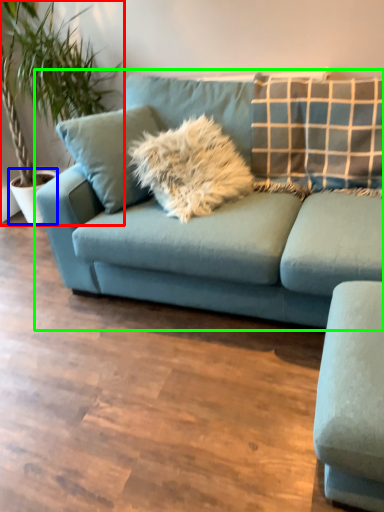
Question: Which is farther away from houseplant (highlighted by a red box)? flowerpot (highlighted by a blue box) or studio couch (highlighted by a green box)?

Choices:
 (A) flowerpot
 (B) studio couch

Answer: (B)